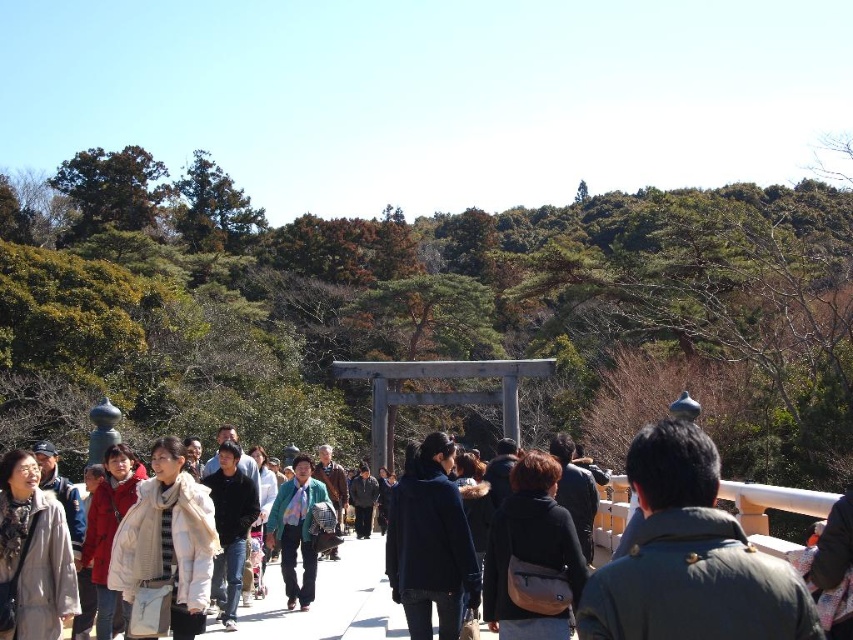
Question: Is light brown wool coat at lower left wider than matte white coat at center?

Choices:
 (A) no
 (B) yes

Answer: (B)

Question: Which point is farther to the camera?

Choices:
 (A) (567, 621)
 (B) (113, 451)
 (C) (374, 490)
 (D) (212, 488)

Answer: (C)

Question: Which of the following is the closest to the observer?

Choices:
 (A) (447, 632)
 (B) (100, 602)
 (C) (270, 544)

Answer: (A)

Question: Does brown leather bag at center have a smaller size compared to black cotton jacket at center?

Choices:
 (A) yes
 (B) no

Answer: (A)

Question: Based on their relative distances, which object is nearer to the matte white coat at center?

Choices:
 (A) dark gray jacket at lower right
 (B) dark blue coat at center

Answer: (B)

Question: Can you confirm if dark blue coat at center is positioned to the right of green textured jacket at center?

Choices:
 (A) yes
 (B) no

Answer: (A)